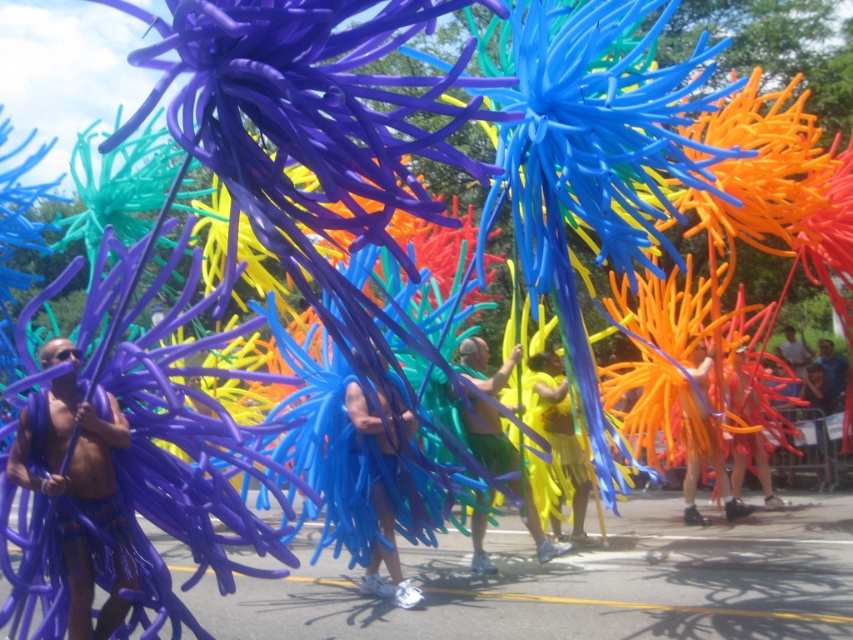
You are standing in the crowd watching the parade and see the yellow matte fabric at center. If you want to reach out and touch it, would you be able to do so without moving closer?

The yellow matte fabric at center is 13.44 feet away from the viewer, which is too far to reach without moving closer.